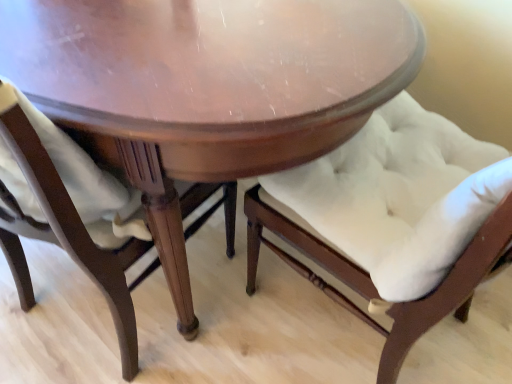
The width and height of the screenshot is (512, 384). What do you see at coordinates (208, 88) in the screenshot?
I see `shiny wood table at center` at bounding box center [208, 88].

Find the location of `satin white cushion at lower left, the 2th chair viewed from the right`. satin white cushion at lower left, the 2th chair viewed from the right is located at coordinates (68, 217).

The width and height of the screenshot is (512, 384). What do you see at coordinates (390, 220) in the screenshot? I see `white tufted cushion at center, the 1th chair viewed from the right` at bounding box center [390, 220].

Locate an element on the screen. shiny wood table at center is located at coordinates (208, 88).

From the image's perspective, which one is positioned lower, white tufted cushion at center, the 1th chair viewed from the right, or shiny wood table at center?

white tufted cushion at center, the 1th chair viewed from the right, appears lower in the image.

Based on the photo, how different are the orientations of white tufted cushion at center, the 1th chair viewed from the right, and shiny wood table at center in degrees?

91.5 degrees.

The image size is (512, 384). In the image, there is a white tufted cushion at center, arranged as the second chair when viewed from the left. In order to click on table above it (from the image's perspective) in this screenshot , I will do `click(208, 88)`.

Can you confirm if white tufted cushion at center, the 1th chair viewed from the right, is thinner than shiny wood table at center?

Yes, white tufted cushion at center, the 1th chair viewed from the right, is thinner than shiny wood table at center.

Consider the image. Between shiny wood table at center and white tufted cushion at center, the 1th chair viewed from the right, which one has larger width?

Wider between the two is shiny wood table at center.

Locate an element on the screen. The width and height of the screenshot is (512, 384). chair that is the 1st one above the shiny wood table at center (from a real-world perspective) is located at coordinates (390, 220).

Is shiny wood table at center in front of or behind white tufted cushion at center, the 1th chair viewed from the right, in the image?

shiny wood table at center is positioned farther from the viewer than white tufted cushion at center, the 1th chair viewed from the right.

From a real-world perspective, between shiny wood table at center and white tufted cushion at center, arranged as the second chair when viewed from the left, who is vertically higher?

white tufted cushion at center, arranged as the second chair when viewed from the left, from a real-world perspective.

From the image's perspective, between satin white cushion at lower left, which appears as the first chair when viewed from the left, and shiny wood table at center, which one is located above?

shiny wood table at center is shown above in the image.

Where is `table that is above the satin white cushion at lower left, the 2th chair viewed from the right (from the image's perspective)`? table that is above the satin white cushion at lower left, the 2th chair viewed from the right (from the image's perspective) is located at coordinates (208, 88).

From a real-world perspective, is satin white cushion at lower left, which appears as the first chair when viewed from the left, above or below shiny wood table at center?

satin white cushion at lower left, which appears as the first chair when viewed from the left, is situated higher than shiny wood table at center in the real world.

Does point (86, 183) appear closer or farther from the camera than point (380, 19)?

Clearly, point (86, 183) is closer to the camera than point (380, 19).

From the picture: Does satin white cushion at lower left, which appears as the first chair when viewed from the left, touch white tufted cushion at center, arranged as the second chair when viewed from the left?

No, satin white cushion at lower left, which appears as the first chair when viewed from the left, is not in contact with white tufted cushion at center, arranged as the second chair when viewed from the left.

Looking at the image, does satin white cushion at lower left, the 2th chair viewed from the right, seem bigger or smaller compared to white tufted cushion at center, the 1th chair viewed from the right?

satin white cushion at lower left, the 2th chair viewed from the right, is bigger than white tufted cushion at center, the 1th chair viewed from the right.

Measure the distance between satin white cushion at lower left, which appears as the first chair when viewed from the left, and white tufted cushion at center, arranged as the second chair when viewed from the left.

A distance of 36.71 centimeters exists between satin white cushion at lower left, which appears as the first chair when viewed from the left, and white tufted cushion at center, arranged as the second chair when viewed from the left.

Which is closer to the camera, (148,240) or (430,115)?

Positioned in front is point (148,240).

From the shiny wood table at center, count 1st chairs forward and point to it. Please provide its 2D coordinates.

[(68, 217)]

How distant is shiny wood table at center from satin white cushion at lower left, which appears as the first chair when viewed from the left?

shiny wood table at center is 8.98 inches away from satin white cushion at lower left, which appears as the first chair when viewed from the left.

From the image's perspective, which one is positioned lower, shiny wood table at center or satin white cushion at lower left, which appears as the first chair when viewed from the left?

satin white cushion at lower left, which appears as the first chair when viewed from the left.

Considering the relative sizes of shiny wood table at center and satin white cushion at lower left, which appears as the first chair when viewed from the left, in the image provided, is shiny wood table at center thinner than satin white cushion at lower left, which appears as the first chair when viewed from the left,?

In fact, shiny wood table at center might be wider than satin white cushion at lower left, which appears as the first chair when viewed from the left.

Does white tufted cushion at center, arranged as the second chair when viewed from the left, turn towards satin white cushion at lower left, the 2th chair viewed from the right?

No, white tufted cushion at center, arranged as the second chair when viewed from the left, does not turn towards satin white cushion at lower left, the 2th chair viewed from the right.

Is white tufted cushion at center, arranged as the second chair when viewed from the left, next to satin white cushion at lower left, the 2th chair viewed from the right?

No, white tufted cushion at center, arranged as the second chair when viewed from the left, is not with satin white cushion at lower left, the 2th chair viewed from the right.

Can you confirm if white tufted cushion at center, the 1th chair viewed from the right, is taller than satin white cushion at lower left, the 2th chair viewed from the right?

Yes, white tufted cushion at center, the 1th chair viewed from the right, is taller than satin white cushion at lower left, the 2th chair viewed from the right.

Which object is wider, white tufted cushion at center, arranged as the second chair when viewed from the left, or satin white cushion at lower left, which appears as the first chair when viewed from the left?

white tufted cushion at center, arranged as the second chair when viewed from the left, is wider.

Where is `table lying above the white tufted cushion at center, arranged as the second chair when viewed from the left (from the image's perspective)`? Image resolution: width=512 pixels, height=384 pixels. table lying above the white tufted cushion at center, arranged as the second chair when viewed from the left (from the image's perspective) is located at coordinates (208, 88).

You are a GUI agent. You are given a task and a screenshot of the screen. Output one action in this format:
    pyautogui.click(x=<x>, y=<y>)
    Task: Click on the 2nd chair positioned below the shiny wood table at center (from the image's perspective)
    The height and width of the screenshot is (384, 512).
    Given the screenshot: What is the action you would take?
    pyautogui.click(x=390, y=220)

From the image, which object appears to be farther from satin white cushion at lower left, the 2th chair viewed from the right, white tufted cushion at center, arranged as the second chair when viewed from the left, or shiny wood table at center?

The object further to satin white cushion at lower left, the 2th chair viewed from the right, is white tufted cushion at center, arranged as the second chair when viewed from the left.

From the image, which object appears to be farther from shiny wood table at center, satin white cushion at lower left, which appears as the first chair when viewed from the left, or white tufted cushion at center, the 1th chair viewed from the right?

white tufted cushion at center, the 1th chair viewed from the right.

When comparing their distances from white tufted cushion at center, the 1th chair viewed from the right, does shiny wood table at center or satin white cushion at lower left, the 2th chair viewed from the right, seem further?

The object further to white tufted cushion at center, the 1th chair viewed from the right, is satin white cushion at lower left, the 2th chair viewed from the right.

From the image, which object appears to be farther from white tufted cushion at center, the 1th chair viewed from the right, satin white cushion at lower left, the 2th chair viewed from the right, or shiny wood table at center?

Based on the image, satin white cushion at lower left, the 2th chair viewed from the right, appears to be further to white tufted cushion at center, the 1th chair viewed from the right.

Looking at the image, which one is located further to shiny wood table at center, white tufted cushion at center, arranged as the second chair when viewed from the left, or satin white cushion at lower left, the 2th chair viewed from the right?

white tufted cushion at center, arranged as the second chair when viewed from the left, is positioned further to the anchor shiny wood table at center.

Estimate the real-world distances between objects in this image. Which object is closer to satin white cushion at lower left, the 2th chair viewed from the right, shiny wood table at center or white tufted cushion at center, the 1th chair viewed from the right?

shiny wood table at center is positioned closer to the anchor satin white cushion at lower left, the 2th chair viewed from the right.

At what (x,y) coordinates should I click in order to perform the action: click on chair situated between shiny wood table at center and white tufted cushion at center, arranged as the second chair when viewed from the left, from left to right. Please return your answer as a coordinate pair (x, y). This screenshot has height=384, width=512. Looking at the image, I should click on (68, 217).